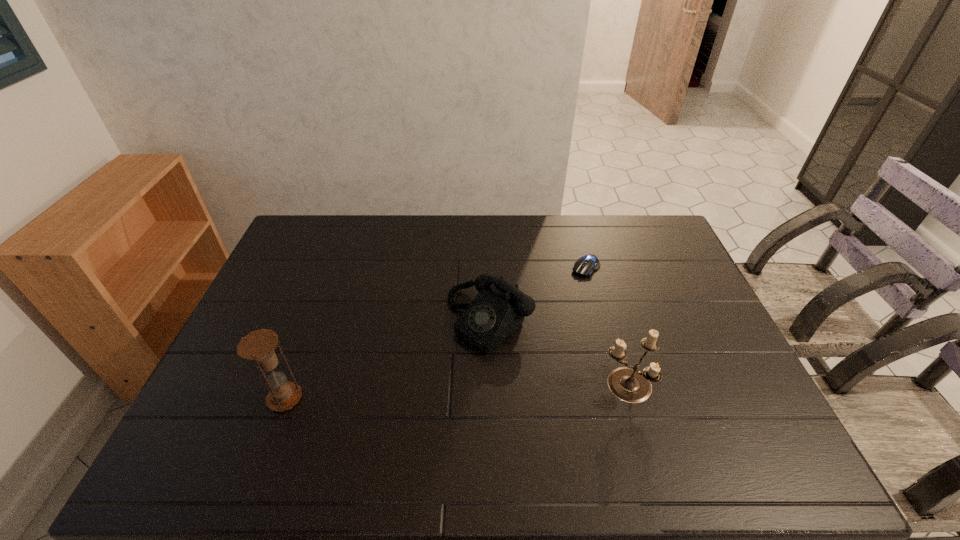
Find the location of a particular element. vacant region at the left edge of the desktop is located at coordinates (248, 397).

Where is `vacant area at the right edge of the desktop`? Image resolution: width=960 pixels, height=540 pixels. vacant area at the right edge of the desktop is located at coordinates (713, 339).

Find the location of a particular element. The width and height of the screenshot is (960, 540). free spot at the far left corner of the desktop is located at coordinates (329, 243).

Where is `free spot between the second farthest object and the hourglass`? free spot between the second farthest object and the hourglass is located at coordinates (387, 359).

At what (x,y) coordinates should I click in order to perform the action: click on vacant point located between the hourglass and the candle holder. Please return your answer as a coordinate pair (x, y). Looking at the image, I should click on (456, 392).

Where is `empty space between the telephone and the leftmost object`? empty space between the telephone and the leftmost object is located at coordinates (387, 359).

The width and height of the screenshot is (960, 540). Find the location of `blank region between the candle holder and the leftmost object`. blank region between the candle holder and the leftmost object is located at coordinates (456, 392).

Identify the location of free space between the second object from left to right and the candle holder. (558, 353).

At what (x,y) coordinates should I click in order to perform the action: click on vacant area that lies between the candle holder and the telephone. Please return your answer as a coordinate pair (x, y). Looking at the image, I should click on (558, 353).

At what (x,y) coordinates should I click in order to perform the action: click on empty space between the third object from right to left and the candle holder. Please return your answer as a coordinate pair (x, y). The width and height of the screenshot is (960, 540). Looking at the image, I should click on (558, 353).